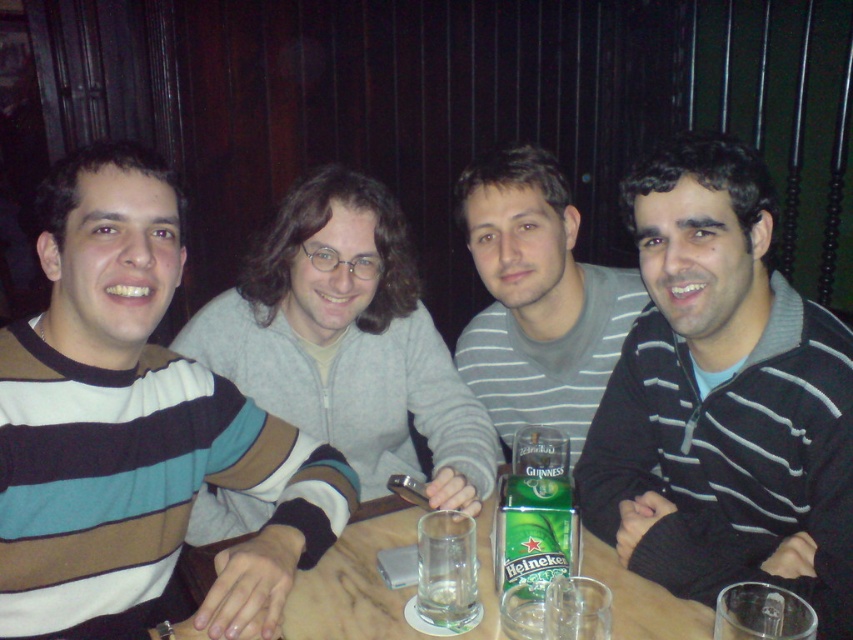
Question: Is striped cotton sweater at left above gray striped sweater at center?

Choices:
 (A) yes
 (B) no

Answer: (B)

Question: Which object appears closest to the camera in this image?

Choices:
 (A) gray striped sweater at center
 (B) wooden table at center
 (C) gray zip-up sweater at center
 (D) black striped sweater at center

Answer: (D)

Question: Can you confirm if black striped sweater at center is thinner than gray zip-up sweater at center?

Choices:
 (A) no
 (B) yes

Answer: (B)

Question: Which object is closer to the camera taking this photo?

Choices:
 (A) gray striped sweater at center
 (B) black striped sweater at center

Answer: (B)

Question: Does black striped sweater at center appear on the left side of gray zip-up sweater at center?

Choices:
 (A) yes
 (B) no

Answer: (B)

Question: Which point appears closest to the camera in this image?

Choices:
 (A) (212, 420)
 (B) (728, 358)
 (C) (584, 540)

Answer: (A)